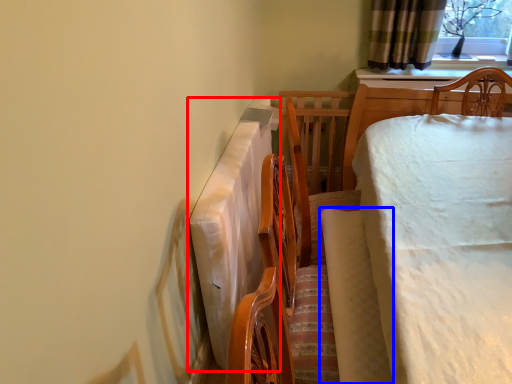
Question: Which object appears farthest to the camera in this image, tablecloth (highlighted by a red box) or blanket (highlighted by a blue box)?

Choices:
 (A) tablecloth
 (B) blanket

Answer: (A)